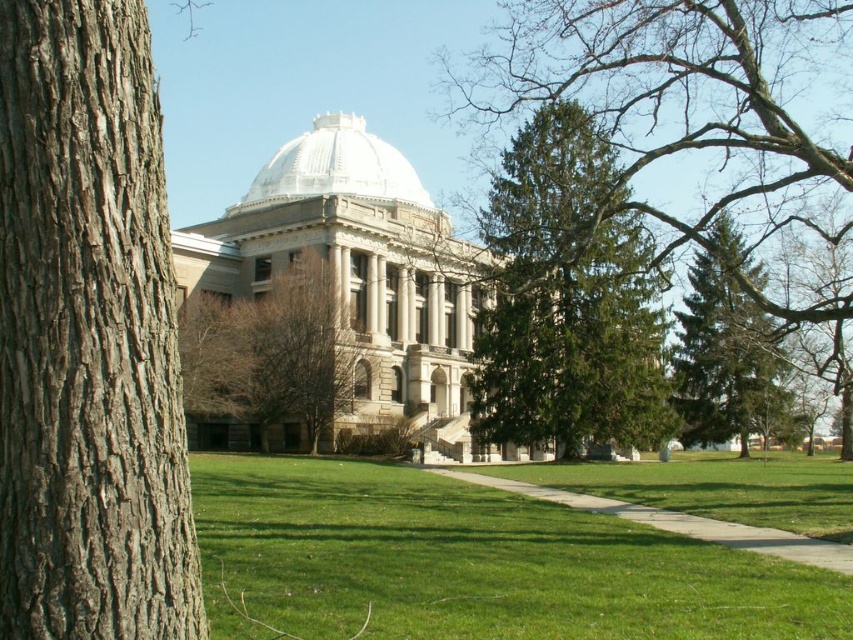
Question: Which point is closer to the camera?

Choices:
 (A) (225, 337)
 (B) (305, 145)
 (C) (563, 106)
 (D) (0, 340)

Answer: (D)

Question: Where is green evergreen tree at center located in relation to white marble dome at center in the image?

Choices:
 (A) above
 (B) below

Answer: (B)

Question: Can you confirm if brown rough bark at left is positioned to the right of green grass at center?

Choices:
 (A) no
 (B) yes

Answer: (A)

Question: Which object appears farthest from the camera in this image?

Choices:
 (A) white marble dome at center
 (B) green needle-like at right
 (C) green grass at center
 (D) brown textured tree at center

Answer: (A)

Question: Which point is farther to the camera?

Choices:
 (A) white marble dome at center
 (B) green grass at center
 (C) brown textured tree at center

Answer: (A)

Question: Does green grass at center appear on the left side of green needle-like at right?

Choices:
 (A) yes
 (B) no

Answer: (A)